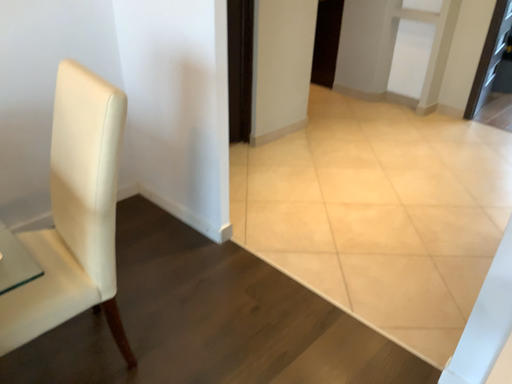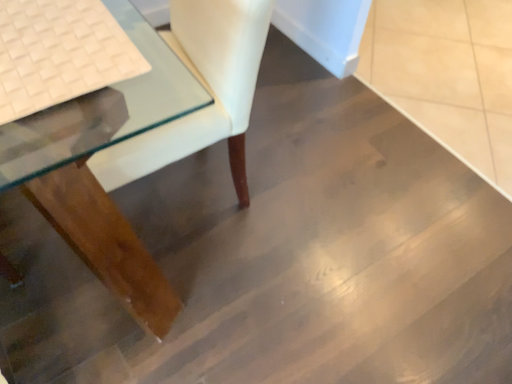
Question: Which way did the camera rotate in the video?

Choices:
 (A) rotated upward
 (B) rotated downward

Answer: (B)